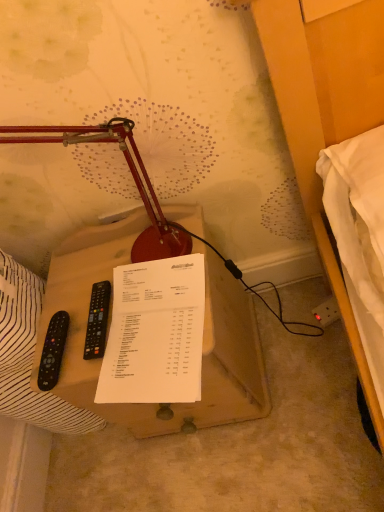
The height and width of the screenshot is (512, 384). Find the location of `free location in front of black plastic remote at left, which is the 1th remote control in left-to-right order`. free location in front of black plastic remote at left, which is the 1th remote control in left-to-right order is located at coordinates (96, 373).